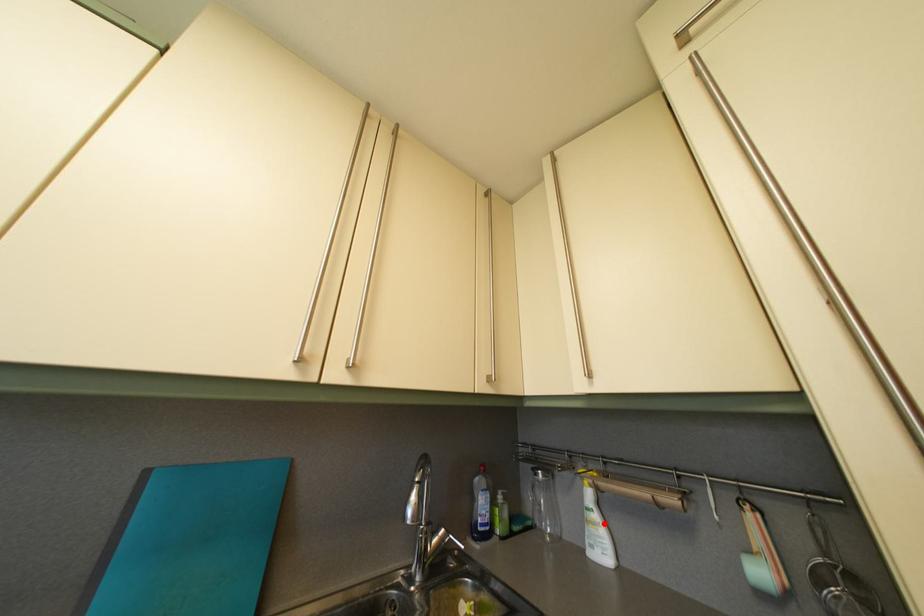
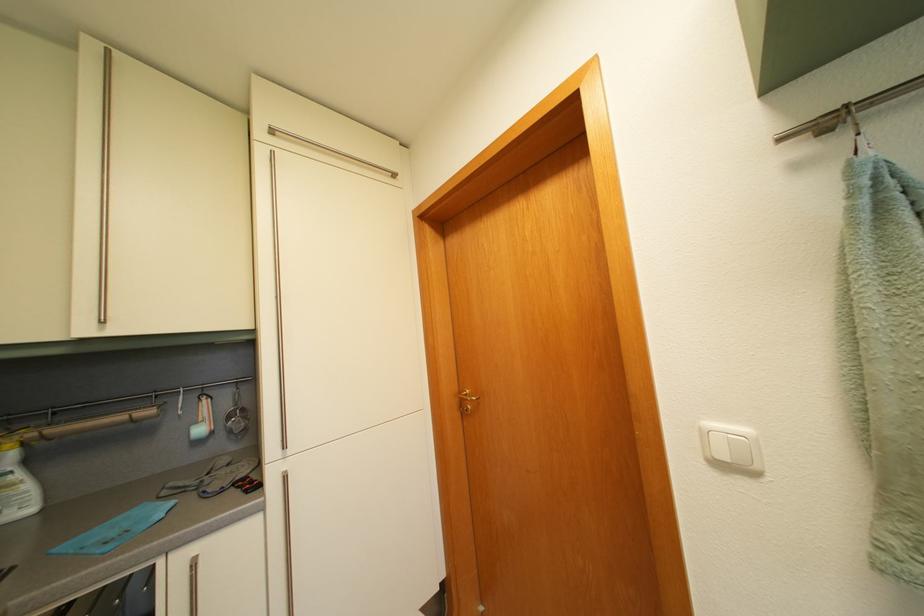
Question: A red point is marked in image1. In image2, is the corresponding 3D point closer to the camera or farther? Reply with the corresponding letter.

Choices:
 (A) The corresponding 3D point is closer.
 (B) The corresponding 3D point is farther.

Answer: (A)